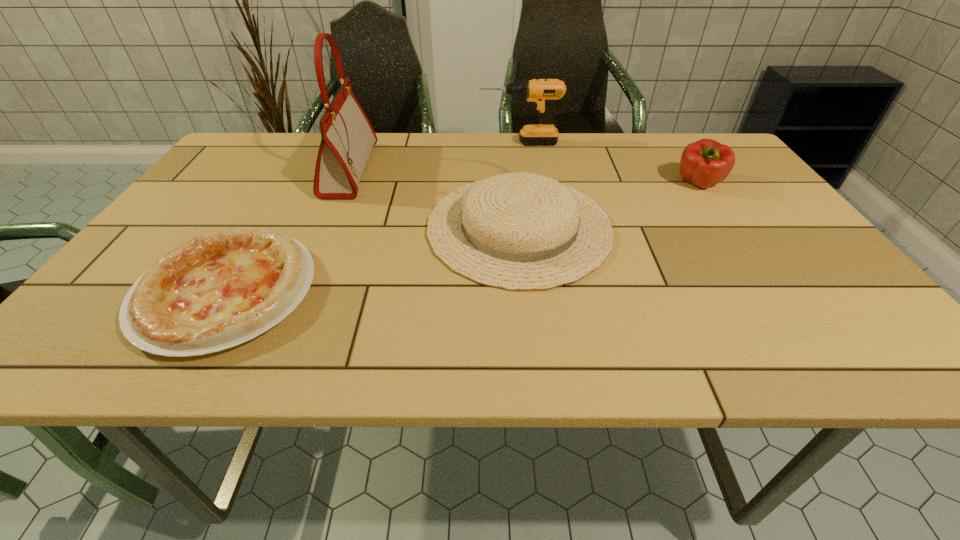
You are a GUI agent. You are given a task and a screenshot of the screen. Output one action in this format:
    pyautogui.click(x=<x>, y=<y>)
    Task: Click on the free space that satisfies the following two spatial constraints: 1. on the front side of the sunhat; 2. on the left side of the tallest object
    The width and height of the screenshot is (960, 540).
    Given the screenshot: What is the action you would take?
    pyautogui.click(x=325, y=227)

Where is `vacant position in the image that satisfies the following two spatial constraints: 1. on the back side of the third tallest object; 2. on the right side of the shortest object`? The height and width of the screenshot is (540, 960). vacant position in the image that satisfies the following two spatial constraints: 1. on the back side of the third tallest object; 2. on the right side of the shortest object is located at coordinates (291, 184).